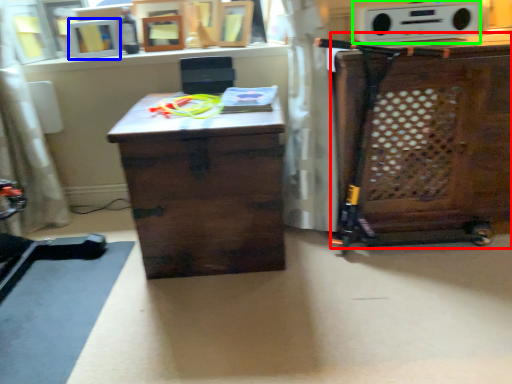
Question: Estimate the real-world distances between objects in this image. Which object is farther from cabinetry (highlighted by a red box), picture frame (highlighted by a blue box) or stereo (highlighted by a green box)?

Choices:
 (A) picture frame
 (B) stereo

Answer: (A)